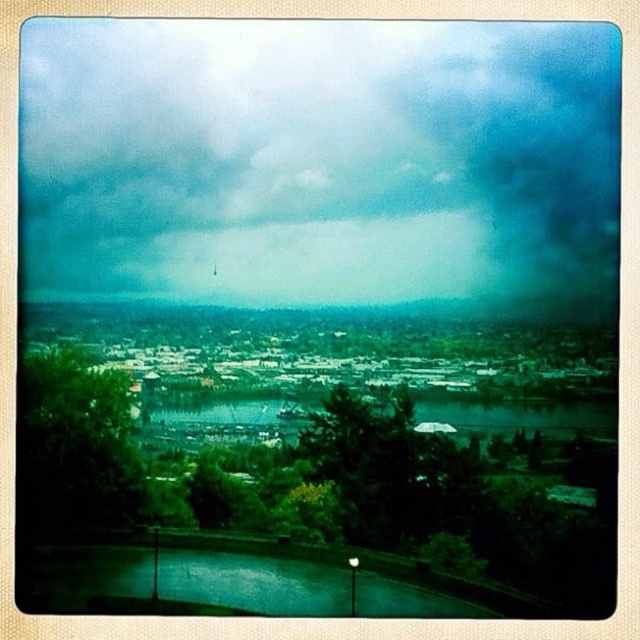
You are an architect designing a new observation deck that needs to have a clear view of both the cloudy sky at upper center and the green glass lake at lower center. Based on the scene, which object will require a taller structure to ensure visibility?

The cloudy sky at upper center requires a taller structure because it has a greater height compared to the green glass lake at lower center.

You are standing on the pathway in the city park and see a point marked at coordinates (253, 582). According to the image, where is this point located?

The point is located on the green glass lake at lower center.